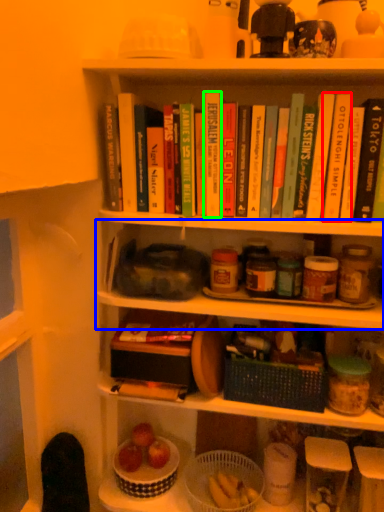
Question: Which is farther away from paperback book (highlighted by a red box)? shelf (highlighted by a blue box) or paperback book (highlighted by a green box)?

Choices:
 (A) shelf
 (B) paperback book

Answer: (A)